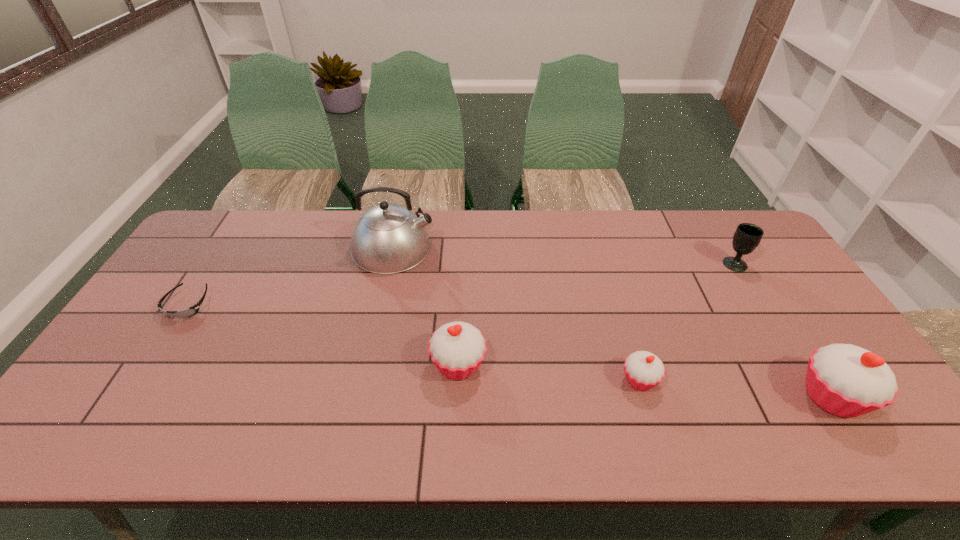
In order to click on free space between the rightmost cupcake and the second object from left to right in this screenshot , I will do `click(612, 322)`.

Identify the location of unoccupied area between the fifth tallest object and the second object from left to right. The image size is (960, 540). (516, 314).

You are a GUI agent. You are given a task and a screenshot of the screen. Output one action in this format:
    pyautogui.click(x=<x>, y=<y>)
    Task: Click on the free space between the shortest object and the leftmost cupcake
    The width and height of the screenshot is (960, 540).
    Given the screenshot: What is the action you would take?
    pyautogui.click(x=324, y=335)

I want to click on vacant space in between the chalice and the shortest cupcake, so click(x=687, y=322).

At what (x,y) coordinates should I click in order to perform the action: click on free space between the sunglasses and the chalice. Please return your answer as a coordinate pair (x, y). Image resolution: width=960 pixels, height=540 pixels. Looking at the image, I should click on (462, 284).

Find the location of `unoccupied area between the rightmost cupcake and the chalice`. unoccupied area between the rightmost cupcake and the chalice is located at coordinates (782, 330).

In order to click on free area in between the tallest object and the shortest object in this screenshot , I will do `click(291, 276)`.

Identify which object is located as the fifth nearest to the fourth object from left to right. Please provide its 2D coordinates. Your answer should be formatted as a tuple, i.e. [(x, y)], where the tuple contains the x and y coordinates of a point satisfying the conditions above.

[(191, 311)]

Locate an element on the screen. Image resolution: width=960 pixels, height=540 pixels. the closest object to the third object from left to right is located at coordinates (388, 238).

Identify which cupcake is located as the second nearest to the tallest object. Please provide its 2D coordinates. Your answer should be formatted as a tuple, i.e. [(x, y)], where the tuple contains the x and y coordinates of a point satisfying the conditions above.

[(644, 370)]